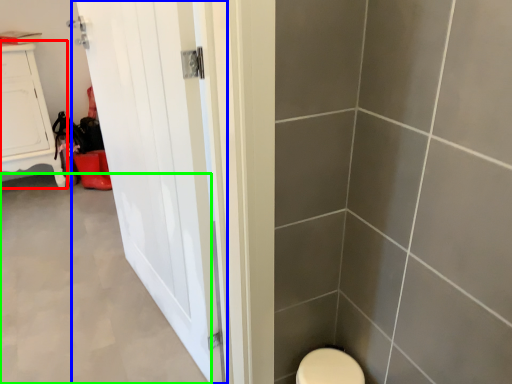
Question: Estimate the real-world distances between objects in this image. Which object is farther from furniture (highlighted by a red box), door (highlighted by a blue box) or plain (highlighted by a green box)?

Choices:
 (A) door
 (B) plain

Answer: (A)